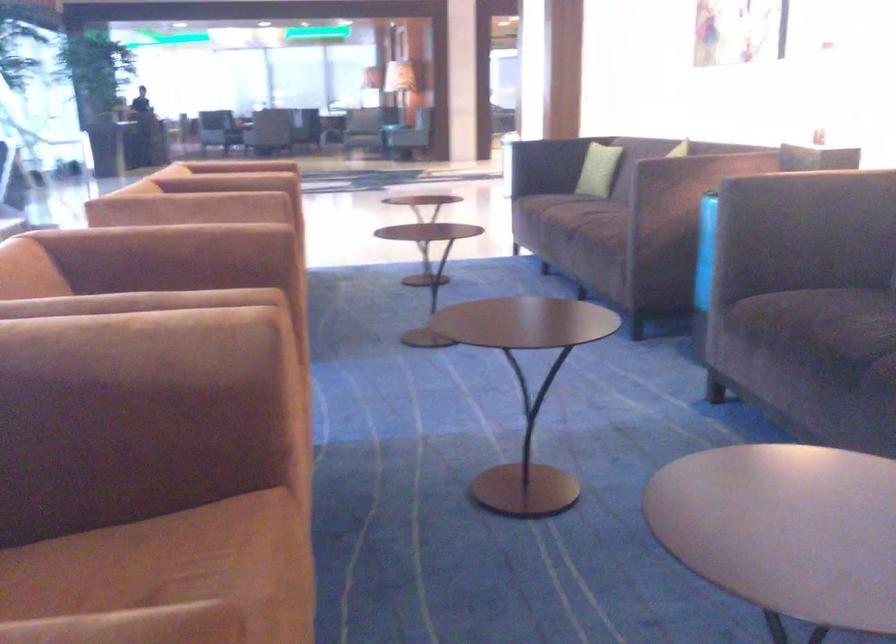
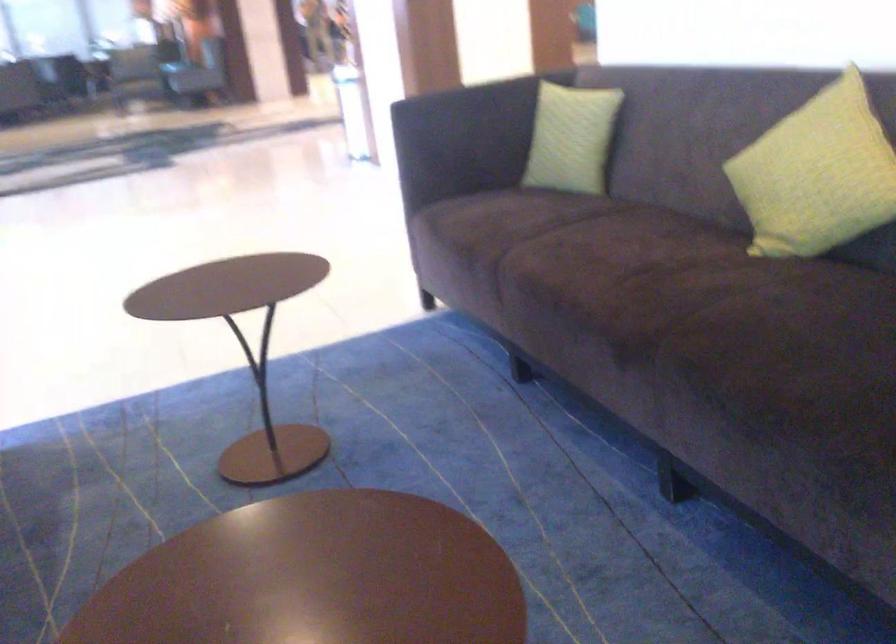
The point at (514,156) is marked in the first image. Where is the corresponding point in the second image?

(509, 221)